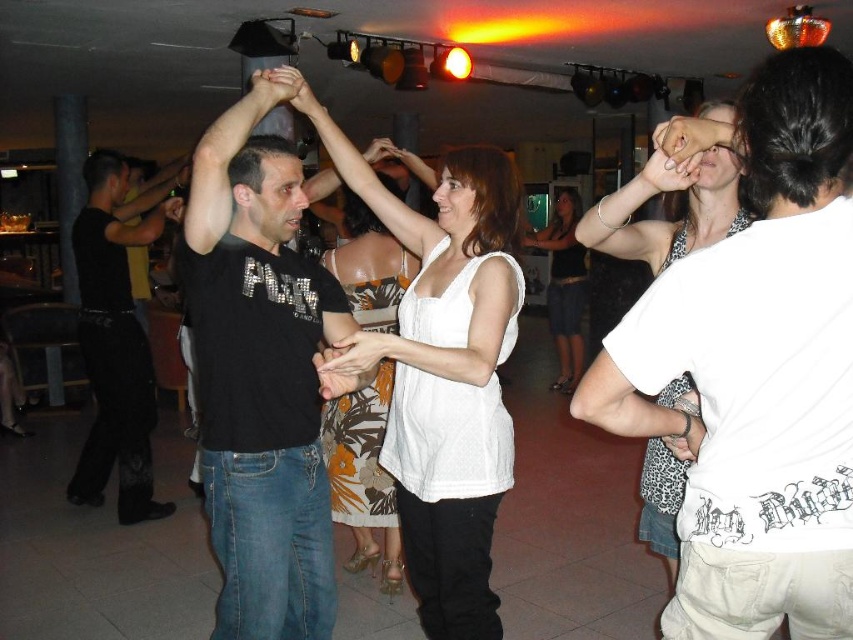
Can you confirm if white printed t-shirt at upper right is wider than white fabric dress at center?

No, white printed t-shirt at upper right is not wider than white fabric dress at center.

Between point (614, 212) and point (579, 204), which one is positioned behind?

The point (579, 204) is behind.

Describe the element at coordinates (668, 220) in the screenshot. I see `white printed t-shirt at upper right` at that location.

Locate an element on the screen. Image resolution: width=853 pixels, height=640 pixels. white printed t-shirt at upper right is located at coordinates (668, 220).

From the picture: Does black smooth pants at left have a larger size compared to white matte tank top at center?

Correct, black smooth pants at left is larger in size than white matte tank top at center.

This screenshot has width=853, height=640. What do you see at coordinates (115, 339) in the screenshot?
I see `black smooth pants at left` at bounding box center [115, 339].

Where is `black smooth pants at left`? black smooth pants at left is located at coordinates (115, 339).

You are a GUI agent. You are given a task and a screenshot of the screen. Output one action in this format:
    pyautogui.click(x=<x>, y=<y>)
    Task: Click on the black smooth pants at left
    
    Given the screenshot: What is the action you would take?
    pyautogui.click(x=115, y=339)

Can you confirm if black matte t-shirt at center is positioned to the right of black smooth pants at left?

Yes, black matte t-shirt at center is to the right of black smooth pants at left.

Does black matte t-shirt at center appear on the left side of black smooth pants at left?

Incorrect, black matte t-shirt at center is not on the left side of black smooth pants at left.

Between point (318, 435) and point (131, 499), which one is positioned behind?

Positioned behind is point (131, 499).

I want to click on black matte t-shirt at center, so click(260, 374).